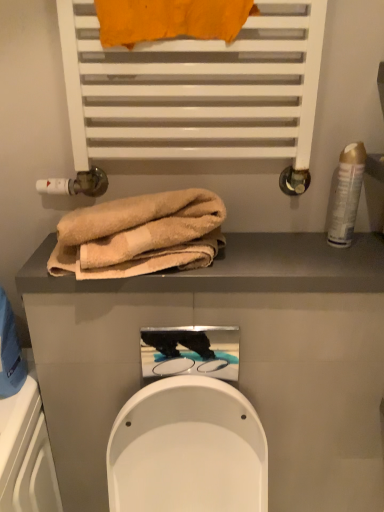
Question: From the image's perspective, relative to white matte towel rack at upper center, is orange fabric towel at upper center, marked as the first towel in a top-to-bottom arrangement, above or below?

Choices:
 (A) below
 (B) above

Answer: (B)

Question: Looking at their shapes, would you say orange fabric towel at upper center, which is counted as the second towel, starting from the bottom, is wider or thinner than white matte towel rack at upper center?

Choices:
 (A) wide
 (B) thin

Answer: (B)

Question: Estimate the real-world distances between objects in this image. Which object is farther from the gold metallic can at right?

Choices:
 (A) beige towel at upper center
 (B) beige soft towel at center, the 1th towel in the bottom-to-top sequence
 (C) white matte towel rack at upper center
 (D) orange fabric towel at upper center, which is counted as the second towel, starting from the bottom

Answer: (D)

Question: Which object is the closest to the beige towel at upper center?

Choices:
 (A) gold metallic can at right
 (B) orange fabric towel at upper center, marked as the first towel in a top-to-bottom arrangement
 (C) white matte towel rack at upper center
 (D) beige soft towel at center, the 1th towel in the bottom-to-top sequence

Answer: (D)